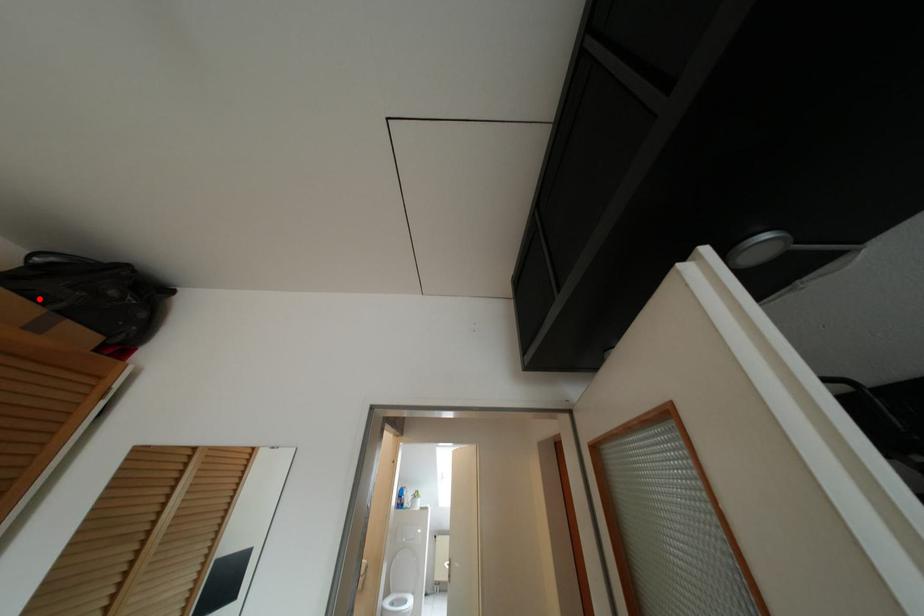
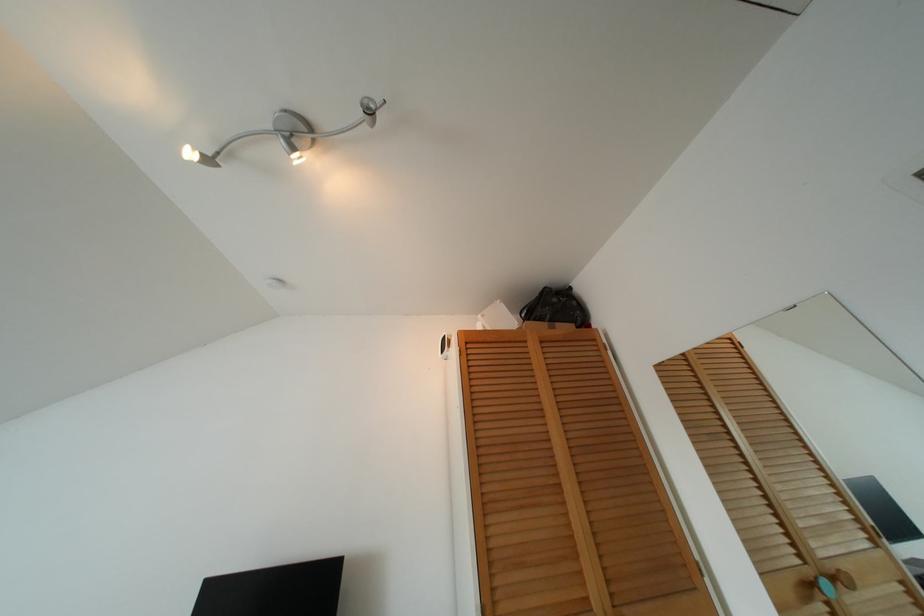
Where in the second image is the point corresponding to the highlighted location from the first image?

(541, 318)